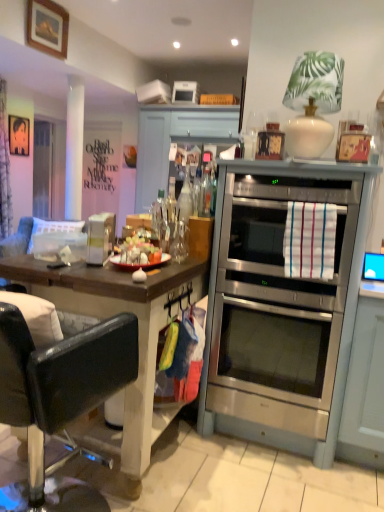
Question: Is metallic silver picture frame at upper left, arranged as the second picture frame when viewed from the top, oriented away from black leather chair at left?

Choices:
 (A) no
 (B) yes

Answer: (A)

Question: Can you confirm if metallic silver picture frame at upper left, arranged as the second picture frame when viewed from the top, is thinner than black leather chair at left?

Choices:
 (A) no
 (B) yes

Answer: (B)

Question: Can you confirm if metallic silver picture frame at upper left, which is counted as the second picture frame, starting from the front, is shorter than black leather chair at left?

Choices:
 (A) yes
 (B) no

Answer: (A)

Question: From a real-world perspective, is metallic silver picture frame at upper left, which is counted as the 2th picture frame, starting from the right, under black leather chair at left?

Choices:
 (A) yes
 (B) no

Answer: (B)

Question: Does metallic silver picture frame at upper left, which is counted as the second picture frame, starting from the front, appear on the left side of black leather chair at left?

Choices:
 (A) no
 (B) yes

Answer: (B)

Question: Considering the relative sizes of metallic silver picture frame at upper left, which is counted as the 2th picture frame, starting from the right, and black leather chair at left in the image provided, is metallic silver picture frame at upper left, which is counted as the 2th picture frame, starting from the right, wider than black leather chair at left?

Choices:
 (A) yes
 (B) no

Answer: (B)

Question: From the image's perspective, does wooden framed picture at upper left, positioned as the 2th picture frame in back-to-front order, appear higher than blue glossy monitor at right?

Choices:
 (A) no
 (B) yes

Answer: (B)

Question: Does wooden framed picture at upper left, marked as the 1th picture frame in a top-to-bottom arrangement, come in front of blue glossy monitor at right?

Choices:
 (A) no
 (B) yes

Answer: (A)

Question: Is wooden framed picture at upper left, positioned as the 2th picture frame in back-to-front order, at the right side of blue glossy monitor at right?

Choices:
 (A) yes
 (B) no

Answer: (B)

Question: Are wooden framed picture at upper left, which is the 2th picture frame in left-to-right order, and blue glossy monitor at right making contact?

Choices:
 (A) yes
 (B) no

Answer: (B)

Question: Does wooden framed picture at upper left, positioned as the 2th picture frame in back-to-front order, have a smaller size compared to blue glossy monitor at right?

Choices:
 (A) yes
 (B) no

Answer: (B)

Question: Can you confirm if wooden framed picture at upper left, which is the 2th picture frame in bottom-to-top order, is positioned to the left of blue glossy monitor at right?

Choices:
 (A) yes
 (B) no

Answer: (A)

Question: Is stainless steel oven at center taller than transparent glass door at left?

Choices:
 (A) yes
 (B) no

Answer: (B)